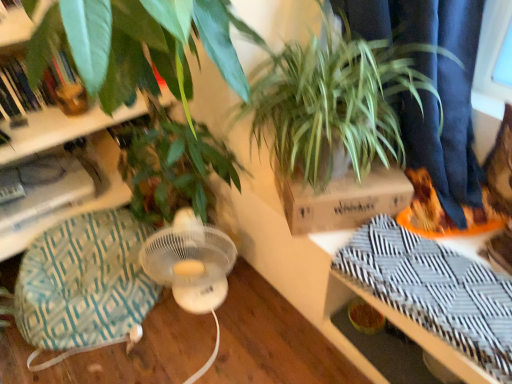
I want to click on white plastic fan at lower left, so click(x=190, y=262).

Describe the element at coordinates (342, 199) in the screenshot. The width and height of the screenshot is (512, 384). I see `brown cardboard box at upper center` at that location.

What is the approximate width of green woven swivel chair at lower left?

19.25 inches.

What is the approximate width of green leafy plant at upper right?

green leafy plant at upper right is 16.54 inches wide.

What do you see at coordinates (443, 212) in the screenshot? I see `orange matte shoe at right` at bounding box center [443, 212].

Image resolution: width=512 pixels, height=384 pixels. I want to click on white plastic fan at lower left, so click(x=190, y=262).

Can you tell me how much white plastic fan at lower left and green leafy plant at upper right differ in facing direction?

white plastic fan at lower left and green leafy plant at upper right are facing 57.3 degrees away from each other.

Does white plastic fan at lower left lie behind green leafy plant at upper right?

Yes, the depth of white plastic fan at lower left is greater than that of green leafy plant at upper right.

Does white plastic fan at lower left touch green leafy plant at upper right?

white plastic fan at lower left is not next to green leafy plant at upper right, and they're not touching.

Who is bigger, white plastic fan at lower left or green leafy plant at upper right?

green leafy plant at upper right.

How different are the orientations of orange matte shoe at right and green woven swivel chair at lower left in degrees?

They differ by 38 degrees in their facing directions.

Does point (409, 179) appear closer or farther from the camera than point (44, 253)?

Clearly, point (409, 179) is closer to the camera than point (44, 253).

You are a GUI agent. You are given a task and a screenshot of the screen. Output one action in this format:
    pyautogui.click(x=<x>, y=<y>)
    Task: Click on the swivel chair on the left of orange matte shoe at right
    This screenshot has height=384, width=512.
    Given the screenshot: What is the action you would take?
    pyautogui.click(x=84, y=285)

In the scene shown: Does orange matte shoe at right come behind green woven swivel chair at lower left?

Yes.

How many degrees apart are the facing directions of green leafy plant at upper right and green woven swivel chair at lower left?

green leafy plant at upper right and green woven swivel chair at lower left are facing 85.2 degrees away from each other.

Does green leafy plant at upper right have a lesser height compared to green woven swivel chair at lower left?

Incorrect, the height of green leafy plant at upper right does not fall short of that of green woven swivel chair at lower left.

Is green leafy plant at upper right directly adjacent to green woven swivel chair at lower left?

No, green leafy plant at upper right is not beside green woven swivel chair at lower left.

Considering the sizes of objects green leafy plant at upper right and green woven swivel chair at lower left in the image provided, who is bigger, green leafy plant at upper right or green woven swivel chair at lower left?

green leafy plant at upper right is bigger.

How much distance is there between green woven swivel chair at lower left and brown cardboard box at upper center?

green woven swivel chair at lower left is 31.17 inches away from brown cardboard box at upper center.

Identify the location of cardboard box lying on the right of green woven swivel chair at lower left. Image resolution: width=512 pixels, height=384 pixels. (342, 199).

In the scene shown: Do you think green woven swivel chair at lower left is within brown cardboard box at upper center, or outside of it?

green woven swivel chair at lower left is located beyond the bounds of brown cardboard box at upper center.

Does green woven swivel chair at lower left turn towards orange matte shoe at right?

No, green woven swivel chair at lower left is not oriented towards orange matte shoe at right.

Is green woven swivel chair at lower left outside of orange matte shoe at right?

Yes, green woven swivel chair at lower left is located beyond the bounds of orange matte shoe at right.

Who is shorter, green woven swivel chair at lower left or orange matte shoe at right?

With less height is orange matte shoe at right.

Where is `swivel chair that is on the left side of orange matte shoe at right`? The image size is (512, 384). swivel chair that is on the left side of orange matte shoe at right is located at coordinates (84, 285).

Does green leafy plant at upper right come in front of orange matte shoe at right?

Yes.

From a real-world perspective, relative to orange matte shoe at right, is green leafy plant at upper right vertically above or below?

From a real-world perspective, green leafy plant at upper right is physically above orange matte shoe at right.

Measure the distance between green leafy plant at upper right and orange matte shoe at right.

13.28 inches.

Would you consider green leafy plant at upper right to be distant from orange matte shoe at right?

That's not correct — green leafy plant at upper right is a little close to orange matte shoe at right.

Is brown cardboard box at upper center positioned beyond the bounds of orange matte shoe at right?

Yes, brown cardboard box at upper center is outside of orange matte shoe at right.

In the image, is brown cardboard box at upper center positioned in front of or behind orange matte shoe at right?

Visually, brown cardboard box at upper center is located in front of orange matte shoe at right.

Between brown cardboard box at upper center and orange matte shoe at right, which one has larger width?

With larger width is brown cardboard box at upper center.

At what (x,y) coordinates should I click in order to perform the action: click on mechanical fan behind the green leafy plant at upper right. Please return your answer as a coordinate pair (x, y). The image size is (512, 384). Looking at the image, I should click on (190, 262).

Locate an element on the screen. shoe above the green woven swivel chair at lower left (from the image's perspective) is located at coordinates (443, 212).

Looking at the image, which one is located further to green leafy plant at upper right, orange matte shoe at right or green woven swivel chair at lower left?

green woven swivel chair at lower left is further to green leafy plant at upper right.

Estimate the real-world distances between objects in this image. Which object is further from orange matte shoe at right, brown cardboard box at upper center or white plastic fan at lower left?

Among the two, white plastic fan at lower left is located further to orange matte shoe at right.

Considering their positions, is green woven swivel chair at lower left positioned closer to orange matte shoe at right than white plastic fan at lower left?

white plastic fan at lower left lies closer to orange matte shoe at right than the other object.

Considering their positions, is white plastic fan at lower left positioned further to orange matte shoe at right than brown cardboard box at upper center?

Based on the image, white plastic fan at lower left appears to be further to orange matte shoe at right.

When comparing their distances from white plastic fan at lower left, does green woven swivel chair at lower left or brown cardboard box at upper center seem further?

brown cardboard box at upper center is positioned further to the anchor white plastic fan at lower left.

From the image, which object appears to be nearer to brown cardboard box at upper center, green leafy plant at upper right or green woven swivel chair at lower left?

green leafy plant at upper right is positioned closer to the anchor brown cardboard box at upper center.

Looking at the image, which one is located further to green leafy plant at upper right, green woven swivel chair at lower left or brown cardboard box at upper center?

green woven swivel chair at lower left is further to green leafy plant at upper right.

Estimate the real-world distances between objects in this image. Which object is further from white plastic fan at lower left, brown cardboard box at upper center or green woven swivel chair at lower left?

brown cardboard box at upper center is positioned further to the anchor white plastic fan at lower left.

This screenshot has height=384, width=512. I want to click on cardboard box located between white plastic fan at lower left and orange matte shoe at right in the left-right direction, so click(x=342, y=199).

Identify the location of mechanical fan between green woven swivel chair at lower left and orange matte shoe at right. (190, 262).

Locate an element on the screen. The image size is (512, 384). cardboard box positioned between green leafy plant at upper right and orange matte shoe at right from near to far is located at coordinates (342, 199).

Where is `houseplant between white plastic fan at lower left and brown cardboard box at upper center in the horizontal direction`? This screenshot has height=384, width=512. houseplant between white plastic fan at lower left and brown cardboard box at upper center in the horizontal direction is located at coordinates (351, 95).